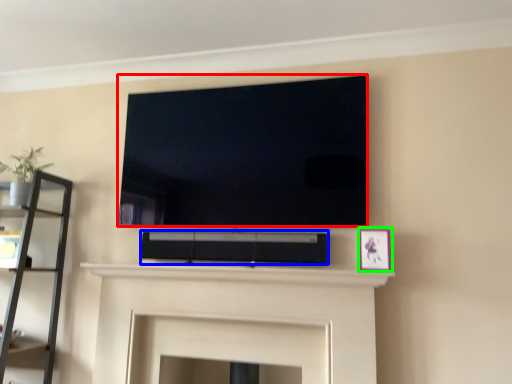
Question: Which is farther away from television (highlighted by a red box)? speaker (highlighted by a blue box) or picture frame (highlighted by a green box)?

Choices:
 (A) speaker
 (B) picture frame

Answer: (B)